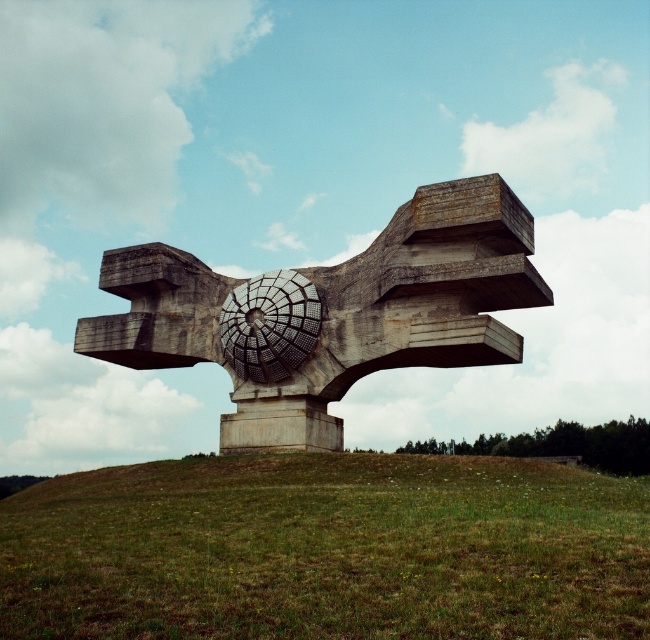
You are an artist planning to paint the scene. You want to highlight the green grass at center and the gray concrete sculpture at center. Which object should you focus on more in your painting to maintain the scene balance?

The gray concrete sculpture at center occupies more space than the green grass at center, so to maintain balance, you should focus more on the gray concrete sculpture at center in your painting.

You are standing in front of the sculpture and looking at the point marked at coordinates (328,548). What do you see there?

At the point marked at coordinates (328,548), you see green grass at center.